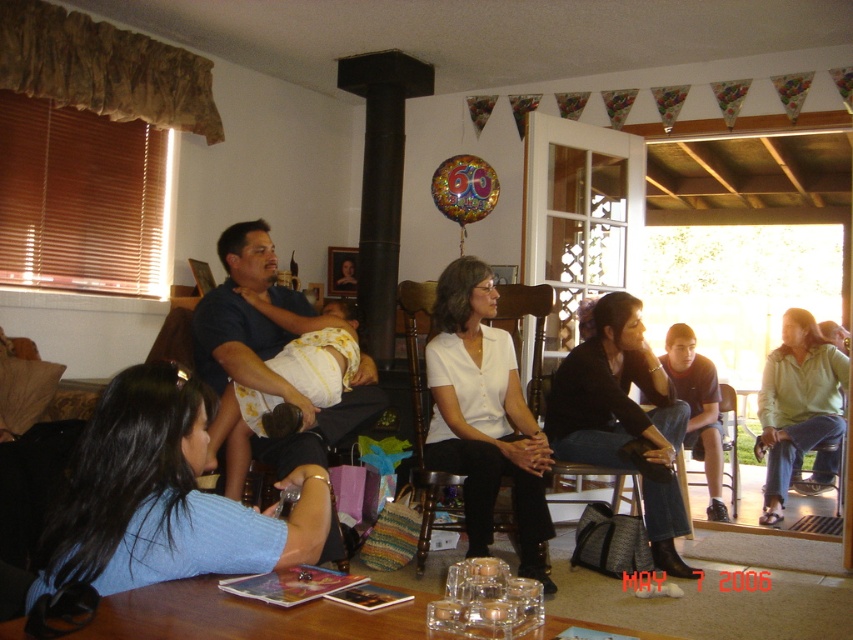
You are a photographer setting up for a family photo. You need to ensure that the matte white shirt at center and the green cotton shirt at lower right are both visible in the shot. Based on their positions, which shirt will appear closer to the camera?

The matte white shirt at center will appear closer to the camera because it is positioned in front of the green cotton shirt at lower right.

You are a guest at the party and want to take a photo with both the matte white shirt at center and the green cotton shirt at lower right. To ensure both shirts are in the frame, should you position yourself to the left or right of the shirts?

You should position yourself to the right of the shirts because the matte white shirt at center is to the left of the green cotton shirt at lower right, so placing yourself to the right would allow both shirts to be captured in the photo frame.